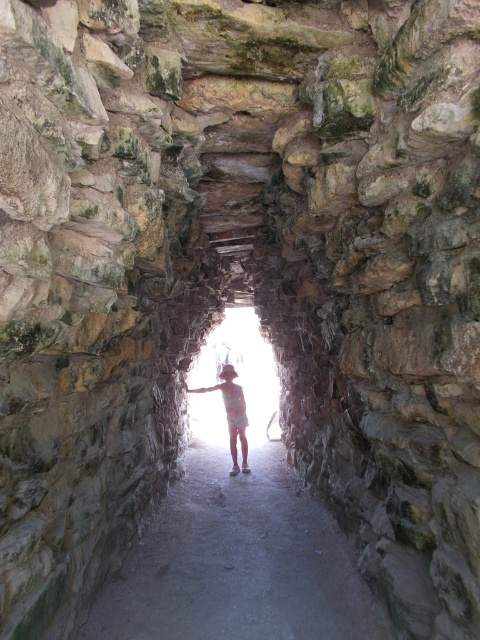
Question: Can you confirm if smooth concrete path at center is positioned above multicolored fabric at center?

Choices:
 (A) yes
 (B) no

Answer: (B)

Question: Observing the image, what is the correct spatial positioning of smooth concrete path at center in reference to multicolored fabric at center?

Choices:
 (A) above
 (B) below

Answer: (B)

Question: Can you confirm if smooth concrete path at center is positioned below multicolored fabric at center?

Choices:
 (A) no
 (B) yes

Answer: (B)

Question: Which point is closer to the camera taking this photo?

Choices:
 (A) (228, 408)
 (B) (230, 545)

Answer: (B)